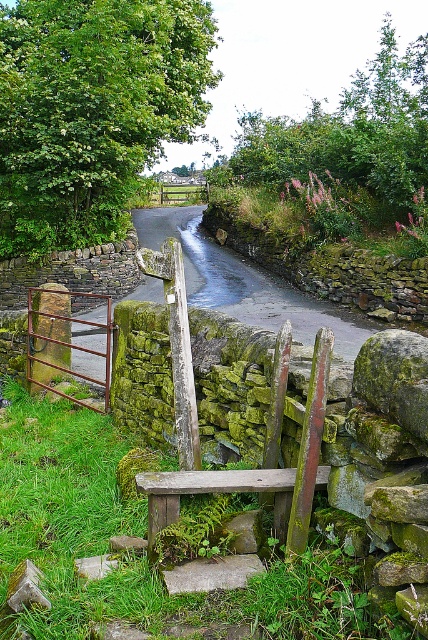
Between green leafy tree at upper left and rusty metal gate at left, which one appears on the right side from the viewer's perspective?

rusty metal gate at left

Describe the element at coordinates (92, 109) in the screenshot. I see `green leafy tree at upper left` at that location.

You are a GUI agent. You are given a task and a screenshot of the screen. Output one action in this format:
    pyautogui.click(x=<x>, y=<y>)
    Task: Click on the green leafy tree at upper left
    
    Given the screenshot: What is the action you would take?
    pyautogui.click(x=92, y=109)

Is smooth concrete path at center above brown wooden fence at center?

Actually, smooth concrete path at center is below brown wooden fence at center.

Consider the image. Is smooth concrete path at center positioned in front of brown wooden fence at center?

Yes, it is.

Is point (152, 220) farther from viewer compared to point (168, 184)?

No, (152, 220) is closer to viewer.

Identify the location of smooth concrete path at center. This screenshot has height=640, width=428. (246, 284).

Image resolution: width=428 pixels, height=640 pixels. Identify the location of green leafy tree at upper left. (92, 109).

Can you confirm if green leafy tree at upper left is positioned below smooth concrete path at center?

Correct, green leafy tree at upper left is located below smooth concrete path at center.

You are a GUI agent. You are given a task and a screenshot of the screen. Output one action in this format:
    pyautogui.click(x=<x>, y=<y>)
    Task: Click on the green leafy tree at upper left
    The height and width of the screenshot is (640, 428).
    Given the screenshot: What is the action you would take?
    pyautogui.click(x=92, y=109)